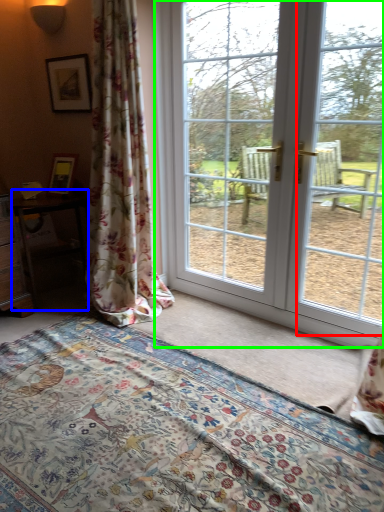
Question: Which object is positioned closest to window screen (highlighted by a red box)? Select from table (highlighted by a blue box) and door (highlighted by a green box).

Choices:
 (A) table
 (B) door

Answer: (B)